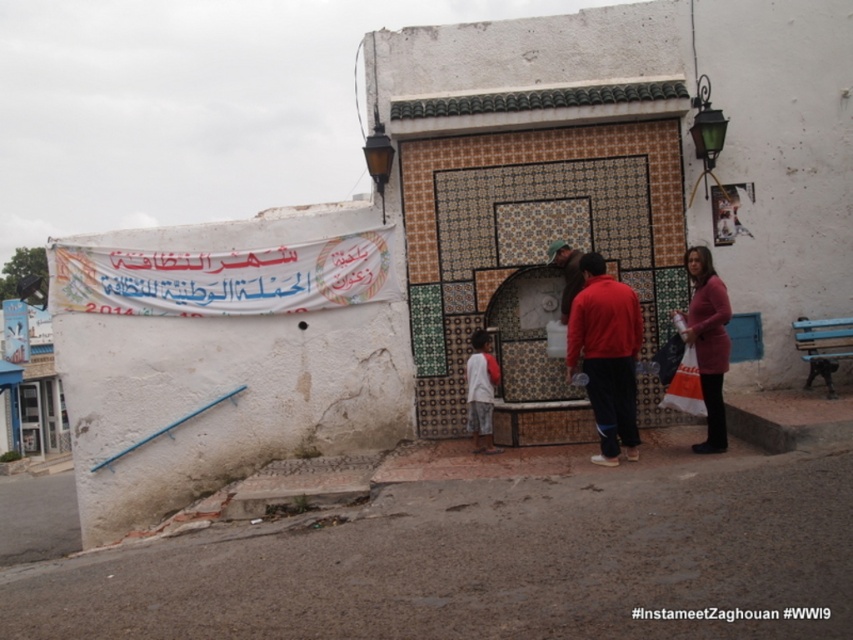
Which is behind, point (469, 362) or point (560, 266)?

The point (560, 266) is more distant.

Can you confirm if white cotton shirt at center is wider than brown leather jacket at center?

No, white cotton shirt at center is not wider than brown leather jacket at center.

Is point (485, 371) behind point (578, 284)?

No, (485, 371) is in front of (578, 284).

At what (x,y) coordinates should I click in order to perform the action: click on white cotton shirt at center. Please return your answer as a coordinate pair (x, y). Looking at the image, I should click on (480, 392).

Who is more distant from viewer, [601,445] or [489,358]?

The point [489,358] is more distant.

Between point (605, 436) and point (485, 445), which one is positioned behind?

Positioned behind is point (485, 445).

Where is `matte red jacket at center`? The height and width of the screenshot is (640, 853). matte red jacket at center is located at coordinates (606, 355).

From the picture: Is pink matte sweater at lower right to the left of brown leather jacket at center from the viewer's perspective?

No, pink matte sweater at lower right is not to the left of brown leather jacket at center.

Is pink matte sweater at lower right below brown leather jacket at center?

Indeed, pink matte sweater at lower right is positioned under brown leather jacket at center.

What do you see at coordinates (708, 340) in the screenshot? The width and height of the screenshot is (853, 640). I see `pink matte sweater at lower right` at bounding box center [708, 340].

This screenshot has height=640, width=853. I want to click on pink matte sweater at lower right, so click(708, 340).